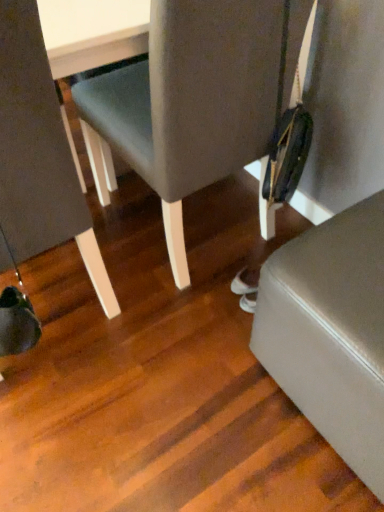
In order to face satin silver knife at lower right, should I rotate leftwards or rightwards?

You should look right and rotate roughly 25.262 degrees.

Describe the element at coordinates (194, 101) in the screenshot. I see `matte gray chair at center, the first chair positioned from the right` at that location.

I want to click on satin silver knife at lower right, so click(x=331, y=332).

Find the location of a particular element. This screenshot has width=384, height=512. chair that is the 1st one above the satin silver knife at lower right (from a real-world perspective) is located at coordinates (194, 101).

Which is closer to the camera, (199, 181) or (307, 282)?

The point (307, 282) is more forward.

Consider the image. In the image, is matte gray chair at center, the first chair positioned from the right, positioned in front of or behind satin silver knife at lower right?

matte gray chair at center, the first chair positioned from the right, is behind satin silver knife at lower right.

From a real-world perspective, is matte gray chair at center, the 2th chair in the left-to-right sequence, above or below satin silver knife at lower right?

matte gray chair at center, the 2th chair in the left-to-right sequence, is situated higher than satin silver knife at lower right in the real world.

I want to click on chair that is the 2nd object located above the satin silver knife at lower right (from the image's perspective), so click(x=194, y=101).

From the image's perspective, who appears lower, satin silver knife at lower right or matte gray chair at center, the first chair positioned from the right?

satin silver knife at lower right, from the image's perspective.

Visually, is satin silver knife at lower right positioned to the left or to the right of matte gray chair at center, the first chair positioned from the right?

Clearly, satin silver knife at lower right is on the right of matte gray chair at center, the first chair positioned from the right, in the image.

Which object is wider, matte gray chair at left, the 2th chair in the right-to-left sequence, or satin silver knife at lower right?

Wider between the two is matte gray chair at left, the 2th chair in the right-to-left sequence.

From the image's perspective, between matte gray chair at left, the 2th chair in the right-to-left sequence, and satin silver knife at lower right, which one is located above?

matte gray chair at left, the 2th chair in the right-to-left sequence, appears higher in the image.

Is the position of matte gray chair at left, the 2th chair in the right-to-left sequence, less distant than that of satin silver knife at lower right?

That is True.

Considering the relative positions of matte gray chair at left, positioned as the first chair in left-to-right order, and matte gray chair at center, the first chair positioned from the right, in the image provided, is matte gray chair at left, positioned as the first chair in left-to-right order, to the right of matte gray chair at center, the first chair positioned from the right, from the viewer's perspective?

No, matte gray chair at left, positioned as the first chair in left-to-right order, is not to the right of matte gray chair at center, the first chair positioned from the right.

Between matte gray chair at left, positioned as the first chair in left-to-right order, and matte gray chair at center, the first chair positioned from the right, which one has more height?

Standing taller between the two is matte gray chair at left, positioned as the first chair in left-to-right order.

Is matte gray chair at left, the 2th chair in the right-to-left sequence, oriented towards matte gray chair at center, the first chair positioned from the right?

No, matte gray chair at left, the 2th chair in the right-to-left sequence, is not oriented towards matte gray chair at center, the first chair positioned from the right.

From the picture: Which is behind, matte gray chair at left, the 2th chair in the right-to-left sequence, or matte gray chair at center, the first chair positioned from the right?

matte gray chair at center, the first chair positioned from the right, is further from the camera.

Which object is further away from the camera, satin silver knife at lower right or matte gray chair at left, the 2th chair in the right-to-left sequence?

satin silver knife at lower right is more distant.

Which point is more forward, (336,330) or (112,306)?

The point (336,330) is closer to the camera.

From a real-world perspective, between satin silver knife at lower right and matte gray chair at left, the 2th chair in the right-to-left sequence, who is vertically lower?

satin silver knife at lower right, from a real-world perspective.

In terms of size, does matte gray chair at center, the first chair positioned from the right, appear bigger or smaller than matte gray chair at left, the 2th chair in the right-to-left sequence?

Considering their sizes, matte gray chair at center, the first chair positioned from the right, takes up more space than matte gray chair at left, the 2th chair in the right-to-left sequence.

Is matte gray chair at left, the 2th chair in the right-to-left sequence, surrounded by matte gray chair at center, the first chair positioned from the right?

No, matte gray chair at center, the first chair positioned from the right, does not contain matte gray chair at left, the 2th chair in the right-to-left sequence.

In the scene shown: Considering the sizes of objects matte gray chair at center, the first chair positioned from the right, and matte gray chair at left, positioned as the first chair in left-to-right order, in the image provided, who is shorter, matte gray chair at center, the first chair positioned from the right, or matte gray chair at left, positioned as the first chair in left-to-right order,?

With less height is matte gray chair at center, the first chair positioned from the right.

Find the location of `furniture below the matte gray chair at center, the first chair positioned from the right (from a real-world perspective)`. furniture below the matte gray chair at center, the first chair positioned from the right (from a real-world perspective) is located at coordinates (331, 332).

Locate an element on the screen. furniture in front of the matte gray chair at center, the first chair positioned from the right is located at coordinates (331, 332).

Estimate the real-world distances between objects in this image. Which object is further from matte gray chair at left, positioned as the first chair in left-to-right order, matte gray chair at center, the first chair positioned from the right, or satin silver knife at lower right?

satin silver knife at lower right is positioned further to the anchor matte gray chair at left, positioned as the first chair in left-to-right order.

Consider the image. Considering their positions, is matte gray chair at center, the first chair positioned from the right, positioned further to satin silver knife at lower right than matte gray chair at left, the 2th chair in the right-to-left sequence?

matte gray chair at left, the 2th chair in the right-to-left sequence.

Considering their positions, is matte gray chair at left, the 2th chair in the right-to-left sequence, positioned closer to matte gray chair at center, the 2th chair in the left-to-right sequence, than satin silver knife at lower right?

matte gray chair at left, the 2th chair in the right-to-left sequence, lies closer to matte gray chair at center, the 2th chair in the left-to-right sequence, than the other object.

Considering their positions, is matte gray chair at left, positioned as the first chair in left-to-right order, positioned closer to satin silver knife at lower right than matte gray chair at center, the first chair positioned from the right?

A: matte gray chair at center, the first chair positioned from the right, is closer to satin silver knife at lower right.

When comparing their distances from matte gray chair at center, the first chair positioned from the right, does satin silver knife at lower right or matte gray chair at left, positioned as the first chair in left-to-right order, seem closer?

The object closer to matte gray chair at center, the first chair positioned from the right, is matte gray chair at left, positioned as the first chair in left-to-right order.

Based on their spatial positions, is satin silver knife at lower right or matte gray chair at center, the 2th chair in the left-to-right sequence, closer to matte gray chair at left, positioned as the first chair in left-to-right order?

matte gray chair at center, the 2th chair in the left-to-right sequence.

This screenshot has height=512, width=384. Find the location of `chair between matte gray chair at left, the 2th chair in the right-to-left sequence, and satin silver knife at lower right`. chair between matte gray chair at left, the 2th chair in the right-to-left sequence, and satin silver knife at lower right is located at coordinates (194, 101).